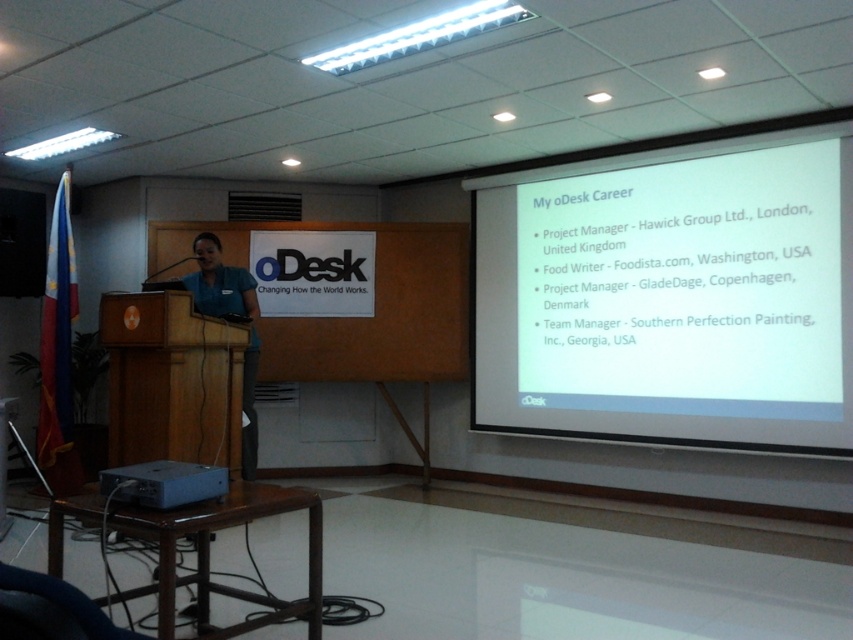
Question: Is white matte projector screen at upper right below gray metallic projector at lower left?

Choices:
 (A) no
 (B) yes

Answer: (A)

Question: Among these points, which one is nearest to the camera?

Choices:
 (A) (201, 467)
 (B) (552, 220)

Answer: (A)

Question: Is white matte projector screen at upper right to the right of gray metallic projector at lower left from the viewer's perspective?

Choices:
 (A) no
 (B) yes

Answer: (B)

Question: Is white matte projector screen at upper right below gray metallic projector at lower left?

Choices:
 (A) no
 (B) yes

Answer: (A)

Question: Which point appears closest to the camera in this image?

Choices:
 (A) (850, 356)
 (B) (157, 499)

Answer: (B)